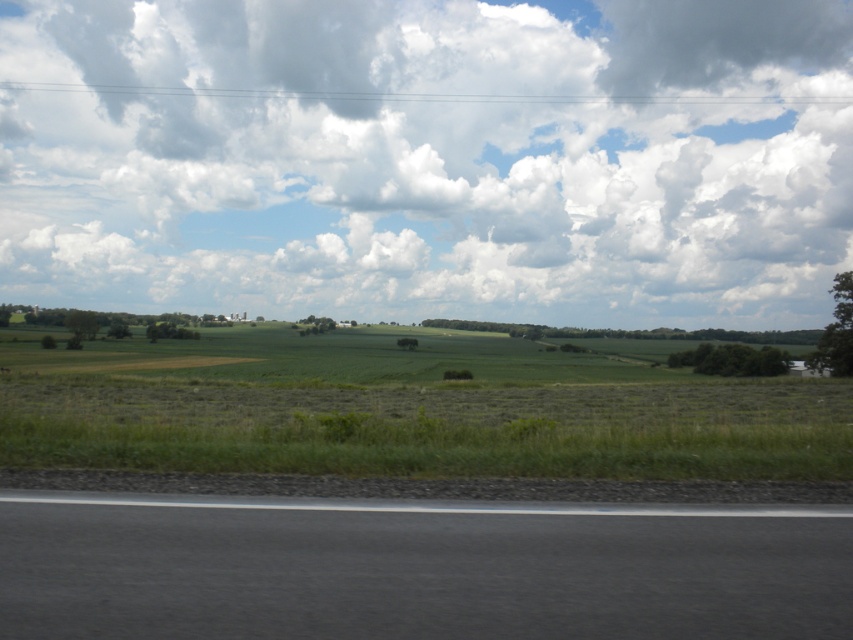
Does green leafy tree at center-right appear on the right side of green grassy field at center?

Correct, you'll find green leafy tree at center-right to the right of green grassy field at center.

Who is positioned more to the left, green leafy tree at center-right or green grassy field at center?

Positioned to the left is green grassy field at center.

Image resolution: width=853 pixels, height=640 pixels. In order to click on green leafy tree at center-right in this screenshot , I will do `click(730, 358)`.

Can you confirm if green leafy tree at right is positioned below green grassy field at center?

No, green leafy tree at right is not below green grassy field at center.

Can you confirm if green leafy tree at right is positioned to the right of green grassy field at center?

Yes, green leafy tree at right is to the right of green grassy field at center.

At what (x,y) coordinates should I click in order to perform the action: click on green leafy tree at right. Please return your answer as a coordinate pair (x, y). Looking at the image, I should click on (836, 332).

What do you see at coordinates (428, 157) in the screenshot?
I see `cloudy sky at upper center` at bounding box center [428, 157].

Does cloudy sky at upper center have a larger size compared to green grassland at lower left?

Indeed, cloudy sky at upper center has a larger size compared to green grassland at lower left.

The height and width of the screenshot is (640, 853). Identify the location of cloudy sky at upper center. (428, 157).